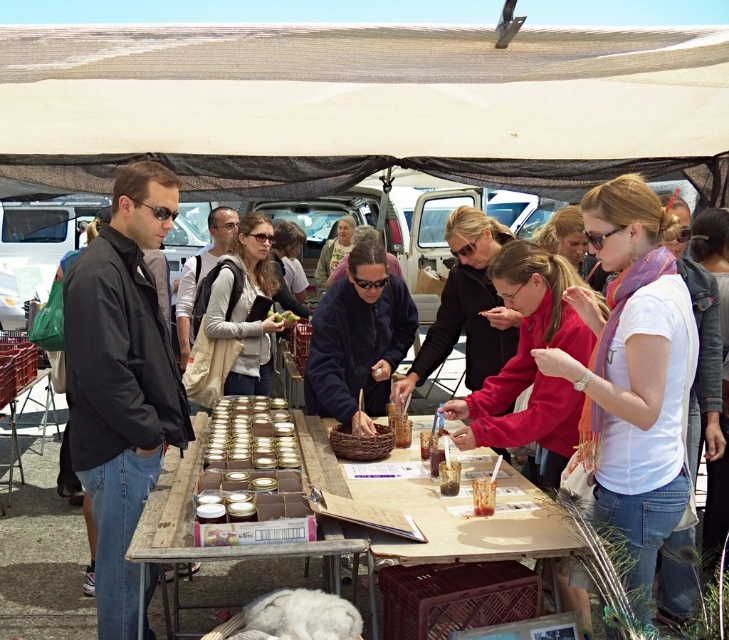
You are a customer at the market and want to pick up both the white matte shirt at center and the black matte jacket at left. If you can only reach 4 feet, can you grab both items without moving your position?

The white matte shirt at center is 5.04 feet away from the black matte jacket at left, so you cannot grab both items without moving your position since the distance between them exceeds your 4 feet reach.

You are a customer at the market and want to approach the vendor. You see the white matte shirt at center and the black matte jacket at left. Which clothing item should you look towards to find the vendor standing behind the table?

The vendor is likely standing behind the black matte jacket at left since the white matte shirt at center is to its right, meaning the black matte jacket at left is closer to the front of the table where the vendor would be.